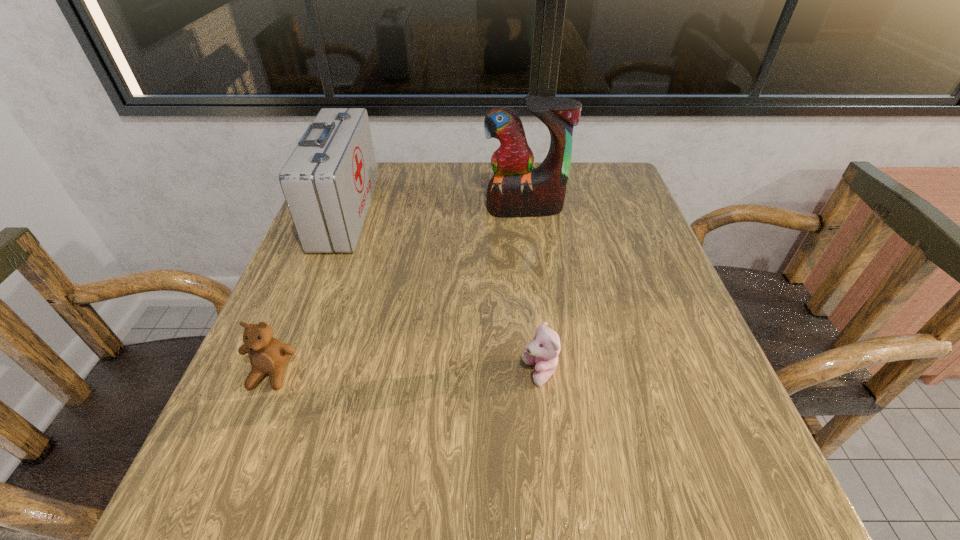
Find the location of `vacant space at the far right corner of the desktop`. vacant space at the far right corner of the desktop is located at coordinates (581, 211).

This screenshot has width=960, height=540. In the image, there is a desktop. Identify the location of free space at the near right corner. (681, 473).

Where is `free spot between the third shortest object and the parrot`? This screenshot has width=960, height=540. free spot between the third shortest object and the parrot is located at coordinates (435, 211).

At what (x,y) coordinates should I click in order to perform the action: click on free space between the right teddy bear and the tallest object. Please return your answer as a coordinate pair (x, y). This screenshot has width=960, height=540. Looking at the image, I should click on (533, 291).

Identify the location of free space between the first-aid kit and the right teddy bear. (443, 293).

Find the location of a particular element. Image resolution: width=960 pixels, height=540 pixels. vacant point located between the tallest object and the left teddy bear is located at coordinates (398, 291).

At what (x,y) coordinates should I click in order to perform the action: click on free space between the tallest object and the left teddy bear. Please return your answer as a coordinate pair (x, y). This screenshot has width=960, height=540. Looking at the image, I should click on (398, 291).

The image size is (960, 540). In order to click on free spot between the third shortest object and the tallest object in this screenshot , I will do `click(435, 211)`.

Identify the location of blank region between the left teddy bear and the parrot. The image size is (960, 540). (398, 291).

Identify the location of free point between the first-aid kit and the right teddy bear. The image size is (960, 540). (443, 293).